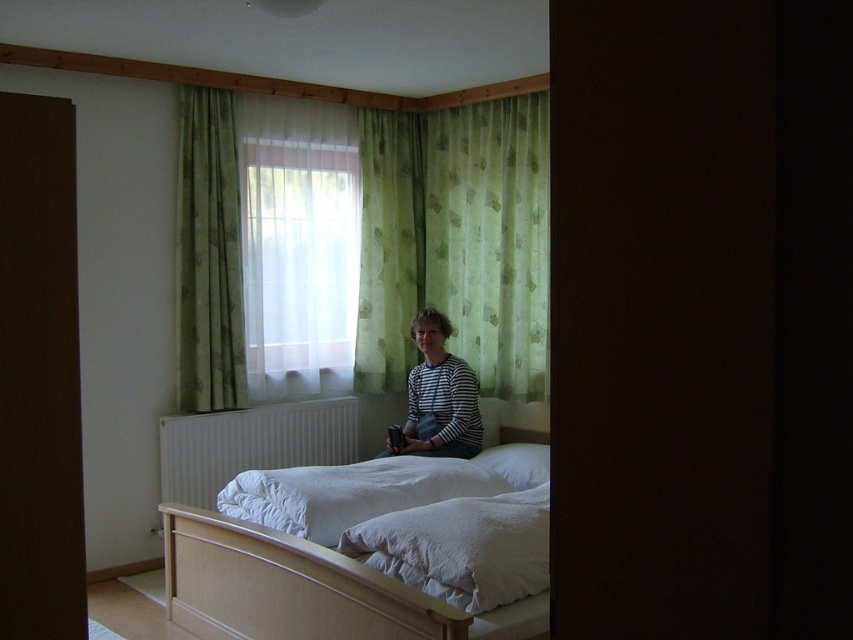
Is green sheer curtains at upper center wider than striped fabric at center?

Correct, the width of green sheer curtains at upper center exceeds that of striped fabric at center.

Does green sheer curtains at upper center lie in front of striped fabric at center?

No, it is behind striped fabric at center.

What do you see at coordinates (357, 244) in the screenshot? This screenshot has width=853, height=640. I see `green sheer curtains at upper center` at bounding box center [357, 244].

The width and height of the screenshot is (853, 640). I want to click on green sheer curtains at upper center, so pos(357,244).

Can you confirm if translucent fabric window at center is positioned to the left of white metallic radiator at lower center?

Incorrect, translucent fabric window at center is not on the left side of white metallic radiator at lower center.

Does translucent fabric window at center have a lesser height compared to white metallic radiator at lower center?

No, translucent fabric window at center is not shorter than white metallic radiator at lower center.

Which is behind, point (293, 307) or point (164, 461)?

The point (293, 307) is behind.

Identify the location of translucent fabric window at center. This screenshot has height=640, width=853. (299, 262).

Which of these two, translucent fabric window at center or striped fabric at center, stands taller?

translucent fabric window at center

Does point (273, 172) come closer to viewer compared to point (387, 444)?

That is False.

Who is more forward, (291, 307) or (445, 444)?

Point (445, 444)

Locate an element on the screen. translucent fabric window at center is located at coordinates (x=299, y=262).